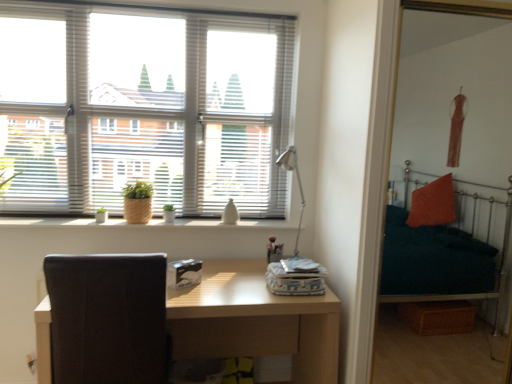
Question: Can you confirm if light brown wooden table at center is bigger than wooden textured window sill at center?

Choices:
 (A) no
 (B) yes

Answer: (B)

Question: Is wooden textured window sill at center a part of light brown wooden table at center?

Choices:
 (A) yes
 (B) no

Answer: (B)

Question: Is light brown wooden table at center with wooden textured window sill at center?

Choices:
 (A) yes
 (B) no

Answer: (B)

Question: Is light brown wooden table at center looking in the opposite direction of wooden textured window sill at center?

Choices:
 (A) no
 (B) yes

Answer: (A)

Question: From a real-world perspective, does light brown wooden table at center stand above wooden textured window sill at center?

Choices:
 (A) yes
 (B) no

Answer: (B)

Question: Is there a large distance between light brown wooden table at center and wooden textured window sill at center?

Choices:
 (A) no
 (B) yes

Answer: (A)

Question: Is white blinds at upper left closer to the viewer compared to metallic silver table lamp at center?

Choices:
 (A) no
 (B) yes

Answer: (A)

Question: From the image's perspective, is white blinds at upper left above metallic silver table lamp at center?

Choices:
 (A) no
 (B) yes

Answer: (B)

Question: Is white blinds at upper left positioned beyond the bounds of metallic silver table lamp at center?

Choices:
 (A) no
 (B) yes

Answer: (B)

Question: Is white blinds at upper left in contact with metallic silver table lamp at center?

Choices:
 (A) yes
 (B) no

Answer: (B)

Question: Does white blinds at upper left have a lesser width compared to metallic silver table lamp at center?

Choices:
 (A) yes
 (B) no

Answer: (A)

Question: Is white blinds at upper left at the right side of metallic silver table lamp at center?

Choices:
 (A) no
 (B) yes

Answer: (A)

Question: Does black leather swivel chair at left come behind metallic silver table lamp at center?

Choices:
 (A) yes
 (B) no

Answer: (B)